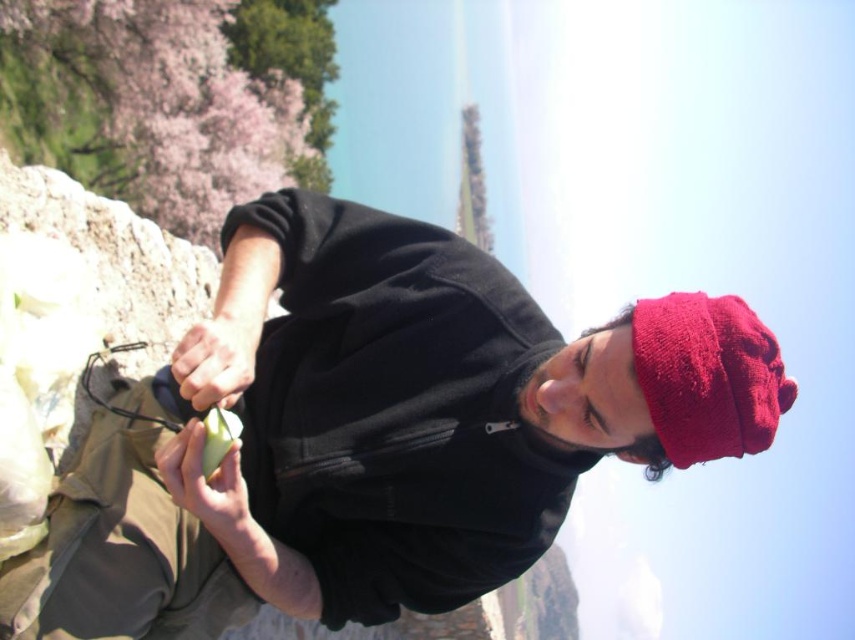
Which is more to the right, matte black hoodie at center or red fuzzy hat at upper right?

red fuzzy hat at upper right is more to the right.

Which is behind, point (620, 452) or point (635, 365)?

The point (620, 452) is more distant.

Where is `matte black hoodie at center`? This screenshot has width=855, height=640. matte black hoodie at center is located at coordinates (385, 435).

Who is higher up, matte black hoodie at center or green matte apple at center?

green matte apple at center is above.

Can you confirm if matte black hoodie at center is positioned to the right of green matte apple at center?

Yes, matte black hoodie at center is to the right of green matte apple at center.

Where is `matte black hoodie at center`? matte black hoodie at center is located at coordinates (385, 435).

Does smooth green leaf at center have a lesser width compared to green matte apple at center?

Indeed, smooth green leaf at center has a lesser width compared to green matte apple at center.

Which is in front, point (256, 348) or point (158, 470)?

Point (158, 470) is in front.

I want to click on smooth green leaf at center, so click(x=217, y=356).